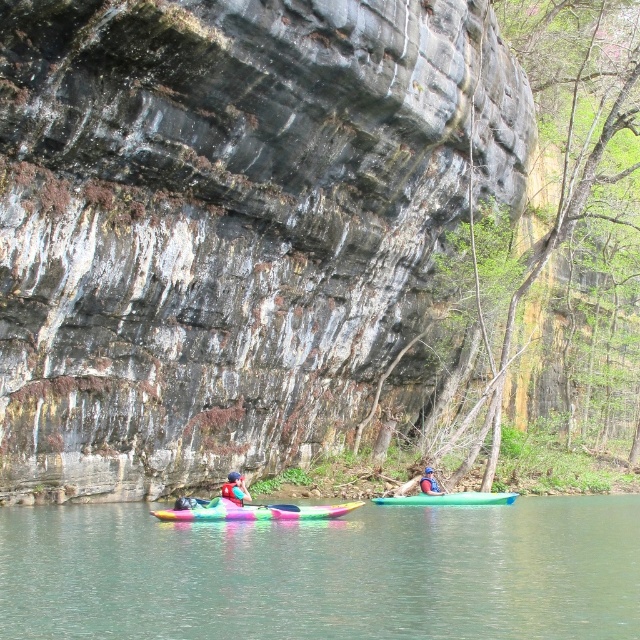
Based on the photo, you are a photographer trying to capture the matte pink kayak at center and the rubber paddle at center in a single shot. Since the camera has a limited depth of field, which object should you focus on to ensure the thinner one is sharp?

The matte pink kayak at center is thinner than the rubber paddle at center, so you should focus on the matte pink kayak at center to ensure it appears sharp in the photo.

You are a photographer trying to capture the kayaks in the image. Since both the green rubber kayak at center and the rainbow plastic kayak at center are in the center, how can you determine which one is closer to the camera?

The green rubber kayak at center is positioned over the rainbow plastic kayak at center, so it appears closer to the camera.

What are the coordinates of the rainbow plastic kayak at center?

The rainbow plastic kayak at center is located at coordinates point (252, 512).